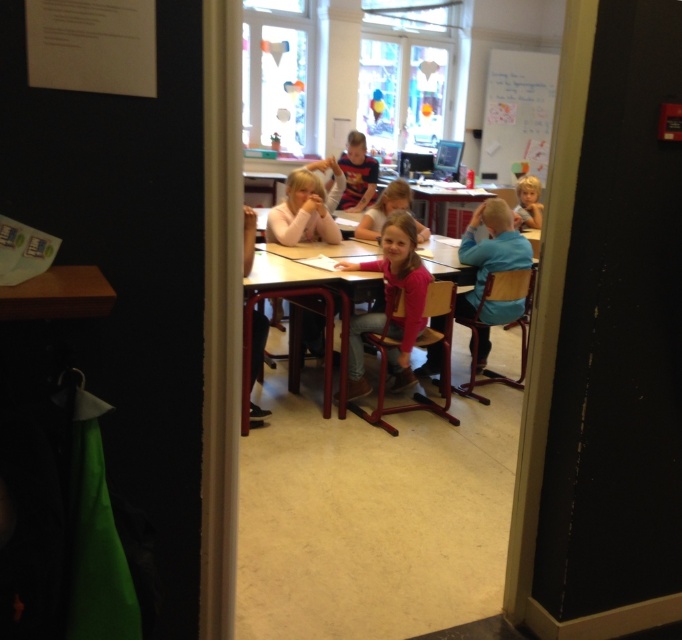
Does pink fabric shirt at center appear under blonde hair at right?

Correct, pink fabric shirt at center is located below blonde hair at right.

Based on the photo, who is lower down, pink fabric shirt at center or blonde hair at right?

Positioned lower is pink fabric shirt at center.

Is point (404, 196) closer to camera compared to point (520, 205)?

Yes.

The height and width of the screenshot is (640, 682). I want to click on pink fabric shirt at center, so click(383, 209).

In the scene shown: Between wooden table at center and blonde hair at right, which one is positioned higher?

blonde hair at right is above.

Does wooden table at center appear on the left side of blonde hair at right?

Correct, you'll find wooden table at center to the left of blonde hair at right.

Does point (318, 268) lie in front of point (524, 182)?

Yes.

Locate an element on the screen. This screenshot has height=640, width=682. wooden table at center is located at coordinates (297, 294).

Is whiteboard at upper right smaller than pink fabric shirt at center?

No.

Is point (544, 163) positioned behind point (379, 221)?

Yes, it is.

What are the coordinates of `whiteboard at upper right` in the screenshot? It's located at (518, 115).